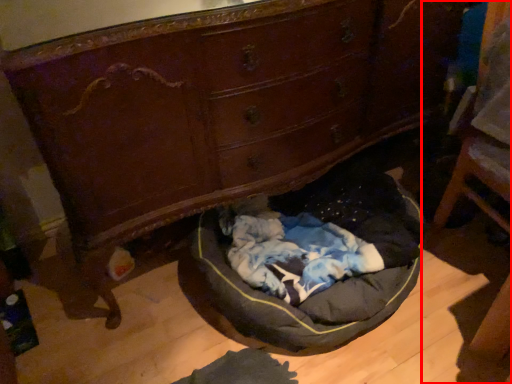
Question: Observing the image, what is the correct spatial positioning of furniture (annotated by the red box) in reference to dog bed?

Choices:
 (A) left
 (B) right

Answer: (B)